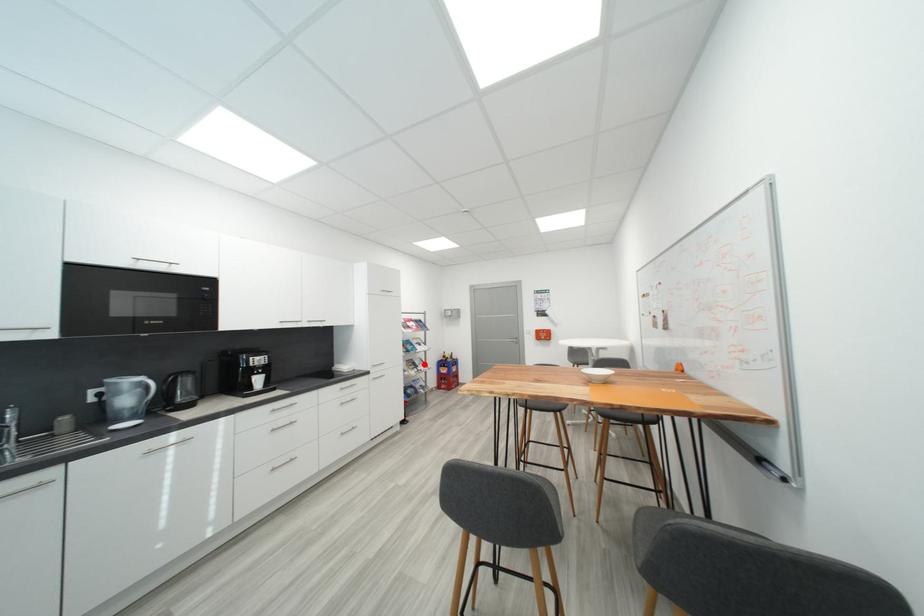
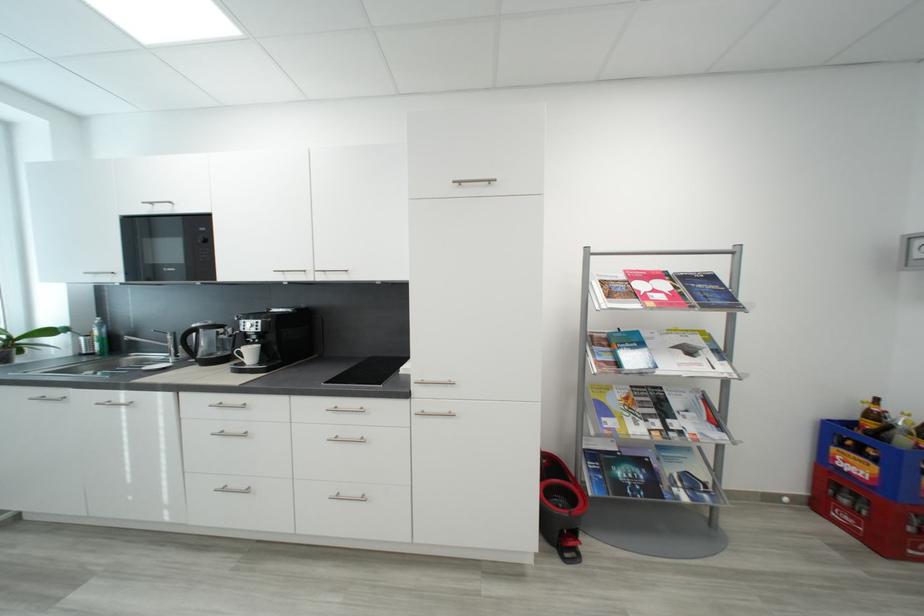
Question: A red point is marked in image1. In image2, is the corresponding 3D point closer to the camera or farther? Reply with the corresponding letter.

Choices:
 (A) The corresponding 3D point is closer.
 (B) The corresponding 3D point is farther.

Answer: (A)